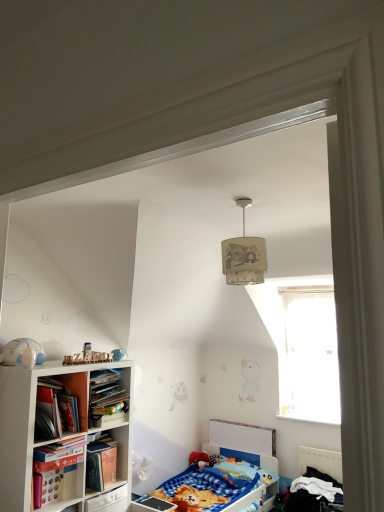
Question: From a real-world perspective, is blue cotton bed at lower right, which is counted as the first bed, starting from the right, below white matte toy at left?

Choices:
 (A) no
 (B) yes

Answer: (B)

Question: Is blue cotton bed at lower right, which is counted as the first bed, starting from the right, positioned with its back to white matte toy at left?

Choices:
 (A) yes
 (B) no

Answer: (B)

Question: Can you confirm if blue cotton bed at lower right, placed as the second bed when sorted from left to right, is shorter than white matte toy at left?

Choices:
 (A) yes
 (B) no

Answer: (B)

Question: Does blue cotton bed at lower right, placed as the second bed when sorted from left to right, come in front of white matte toy at left?

Choices:
 (A) yes
 (B) no

Answer: (B)

Question: Could you tell me if blue cotton bed at lower right, which is counted as the first bed, starting from the right, is turned towards white matte toy at left?

Choices:
 (A) yes
 (B) no

Answer: (B)

Question: From the image's perspective, is white matte toy at left above or below blue fabric bed at lower center, the 1th bed viewed from the left?

Choices:
 (A) below
 (B) above

Answer: (B)

Question: Is point (6, 358) positioned closer to the camera than point (185, 495)?

Choices:
 (A) farther
 (B) closer

Answer: (B)

Question: Would you say white matte toy at left is to the left or to the right of blue fabric bed at lower center, the 1th bed viewed from the left, in the picture?

Choices:
 (A) right
 (B) left

Answer: (B)

Question: From a real-world perspective, is white matte toy at left physically located above or below blue fabric bed at lower center, which appears as the 2th bed when viewed from the right?

Choices:
 (A) above
 (B) below

Answer: (A)

Question: From a real-world perspective, is blue cotton bed at lower right, which is counted as the first bed, starting from the right, above or below hardcover book at left, the 2th book from the bottom?

Choices:
 (A) above
 (B) below

Answer: (B)

Question: In terms of width, does blue cotton bed at lower right, which is counted as the first bed, starting from the right, look wider or thinner when compared to hardcover book at left, the 2th book from the bottom?

Choices:
 (A) thin
 (B) wide

Answer: (B)

Question: From the image's perspective, is blue cotton bed at lower right, which is counted as the first bed, starting from the right, above or below hardcover book at left, the 2th book from the bottom?

Choices:
 (A) below
 (B) above

Answer: (A)

Question: Considering the relative positions of blue cotton bed at lower right, which is counted as the first bed, starting from the right, and hardcover book at left, the 2th book from the bottom, in the image provided, is blue cotton bed at lower right, which is counted as the first bed, starting from the right, to the left or to the right of hardcover book at left, the 2th book from the bottom,?

Choices:
 (A) left
 (B) right

Answer: (B)

Question: Is blue fabric bed at lower center, which appears as the 2th bed when viewed from the right, taller or shorter than hardcover book at left, acting as the first book starting from the top?

Choices:
 (A) tall
 (B) short

Answer: (A)

Question: In the image, is blue fabric bed at lower center, which appears as the 2th bed when viewed from the right, on the left side or the right side of hardcover book at left, acting as the first book starting from the top?

Choices:
 (A) right
 (B) left

Answer: (A)